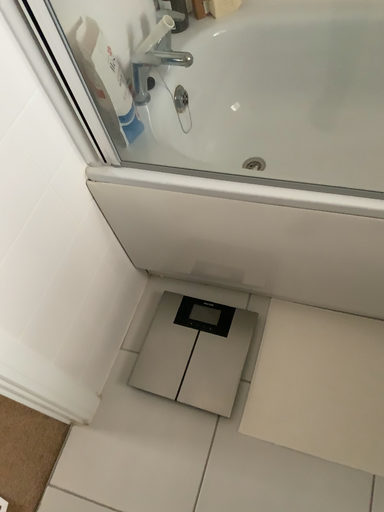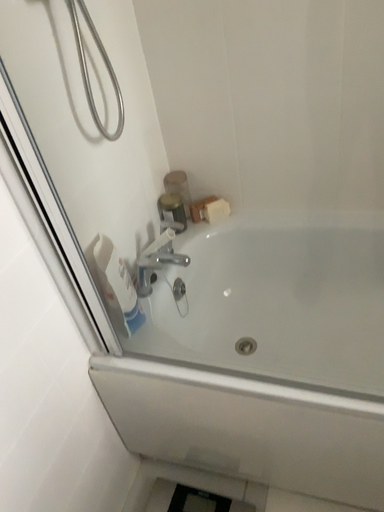
Question: Which way did the camera rotate in the video?

Choices:
 (A) rotated downward
 (B) rotated upward

Answer: (B)